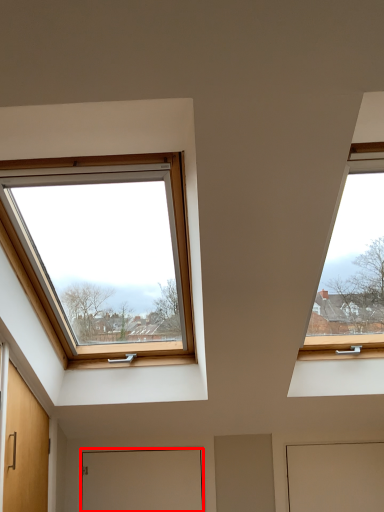
Question: Where is door (annotated by the red box) located in relation to door in the image?

Choices:
 (A) left
 (B) right

Answer: (A)